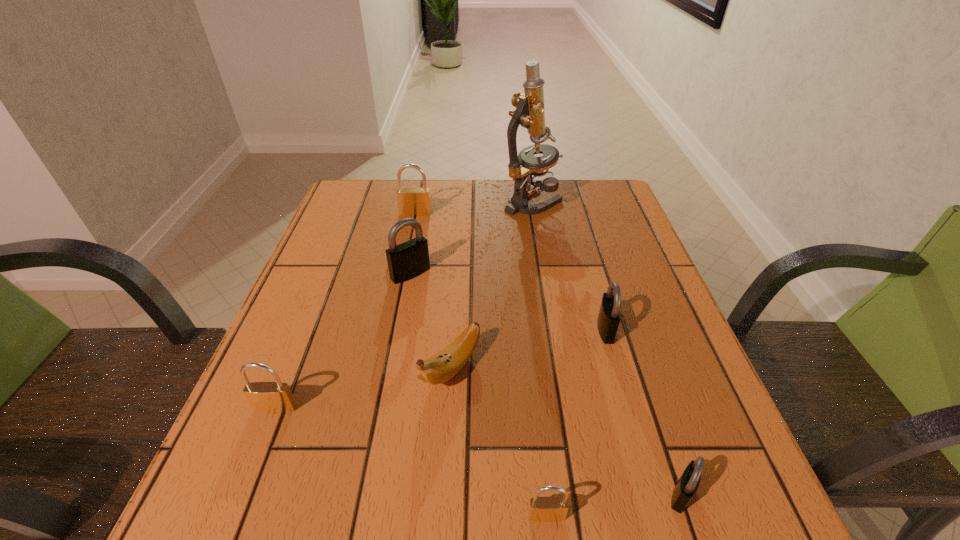
You are a GUI agent. You are given a task and a screenshot of the screen. Output one action in this format:
    pyautogui.click(x=<x>, y=<y>)
    Task: Click on the blank space at the far right corner
    This screenshot has width=960, height=540.
    Given the screenshot: What is the action you would take?
    pyautogui.click(x=603, y=210)

Locate an element on the screen. free space between the second black padlock from right to left and the rightmost padlock is located at coordinates (643, 412).

At what (x,y) coordinates should I click in order to perform the action: click on vacant area between the rightmost black padlock and the smallest brass padlock. Please return your answer as a coordinate pair (x, y). Looking at the image, I should click on (613, 505).

Where is `free space that is in between the nearest brass padlock and the banana`? The image size is (960, 540). free space that is in between the nearest brass padlock and the banana is located at coordinates (499, 442).

Find the location of `vacant space that's between the nearest brass padlock and the yellow banana`. vacant space that's between the nearest brass padlock and the yellow banana is located at coordinates (499, 442).

You are a GUI agent. You are given a task and a screenshot of the screen. Output one action in this format:
    pyautogui.click(x=<x>, y=<y>)
    Task: Click on the free space that is in between the rightmost padlock and the farthest black padlock
    Image resolution: width=960 pixels, height=540 pixels.
    Given the screenshot: What is the action you would take?
    pyautogui.click(x=546, y=384)

You are a GUI agent. You are given a task and a screenshot of the screen. Output one action in this format:
    pyautogui.click(x=<x>, y=<y>)
    Task: Click on the vacant area that lies between the farthest brass padlock and the tallest object
    The image size is (960, 540).
    Given the screenshot: What is the action you would take?
    pyautogui.click(x=474, y=207)

This screenshot has width=960, height=540. In order to click on free space between the third padlock from right to left and the rightmost black padlock in this screenshot , I will do `click(613, 505)`.

Find the location of a particular element. This screenshot has height=540, width=960. vacant point located between the second brass padlock from left to right and the leftmost padlock is located at coordinates (346, 310).

Locate an element on the screen. Image resolution: width=960 pixels, height=540 pixels. unoccupied area between the biggest brass padlock and the rightmost brass padlock is located at coordinates (481, 364).